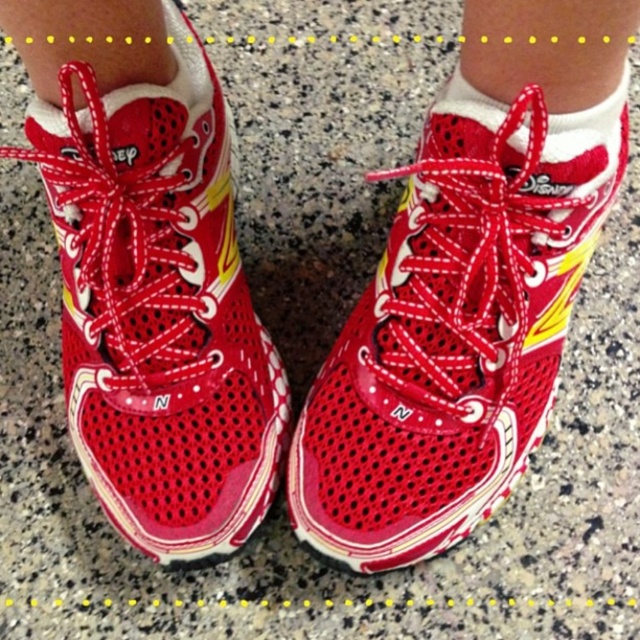
Please provide the 2D coordinates of the shiny red mesh shoe at center in the image.

The shiny red mesh shoe at center is located at coordinates point [454,328].

You are a photographer trying to capture the shiny red mesh shoe at center and the white soft sock at center. Which object should you focus on first if you want to ensure both are in sharp focus?

The shiny red mesh shoe at center is located below the white soft sock at center. To ensure both are in sharp focus, you should focus on the white soft sock at center first since it is farther away from the camera, allowing the depth of field to cover the closer shiny red mesh shoe at center.

You are standing in a room and see the shiny red mesh shoe at center and the white soft sock at center. Which object is positioned to the left?

The shiny red mesh shoe at center is to the left of the white soft sock at center.